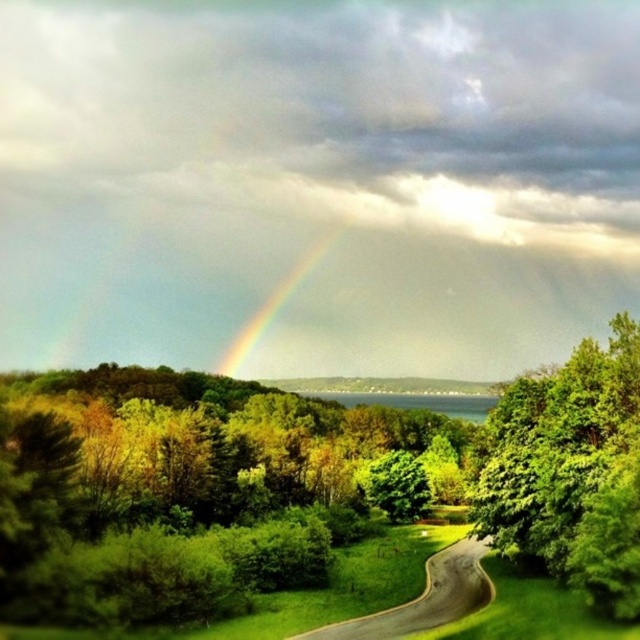
Between point (502, 456) and point (324, 244), which one is positioned behind?

Point (324, 244)

Between green leafy tree at right and rainbow at center, which one is positioned higher?

Positioned higher is rainbow at center.

The height and width of the screenshot is (640, 640). What do you see at coordinates (570, 472) in the screenshot?
I see `green leafy tree at right` at bounding box center [570, 472].

Locate an element on the screen. The height and width of the screenshot is (640, 640). green leafy tree at right is located at coordinates (570, 472).

Which is in front, point (461, 547) or point (230, 355)?

Point (461, 547) is more forward.

Can you confirm if green asphalt road at center is thinner than rainbow at center?

Correct, green asphalt road at center's width is less than rainbow at center's.

Does point (472, 611) come behind point (248, 330)?

No, it is not.

Where is `green asphalt road at center`? green asphalt road at center is located at coordinates (424, 596).

Does green leafy tree at right appear on the left side of green asphalt road at center?

Incorrect, green leafy tree at right is not on the left side of green asphalt road at center.

Who is lower down, green leafy tree at right or green asphalt road at center?

green asphalt road at center is lower down.

Between point (634, 573) and point (452, 602), which one is positioned behind?

The point (452, 602) is more distant.

This screenshot has height=640, width=640. Identify the location of green leafy tree at right. (570, 472).